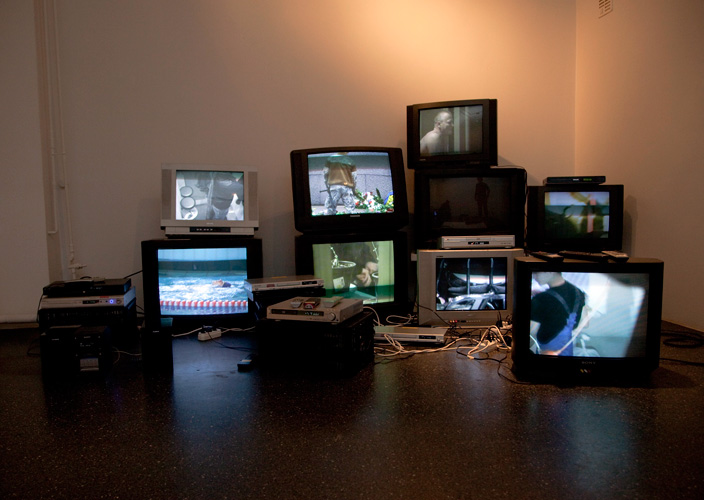
Locate an element on the screen. tv is located at coordinates (486, 129).